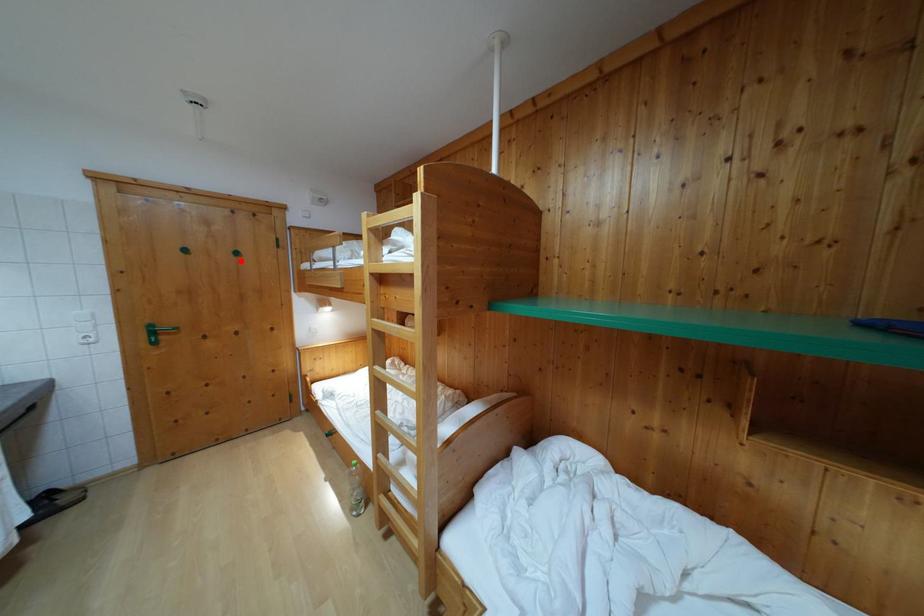
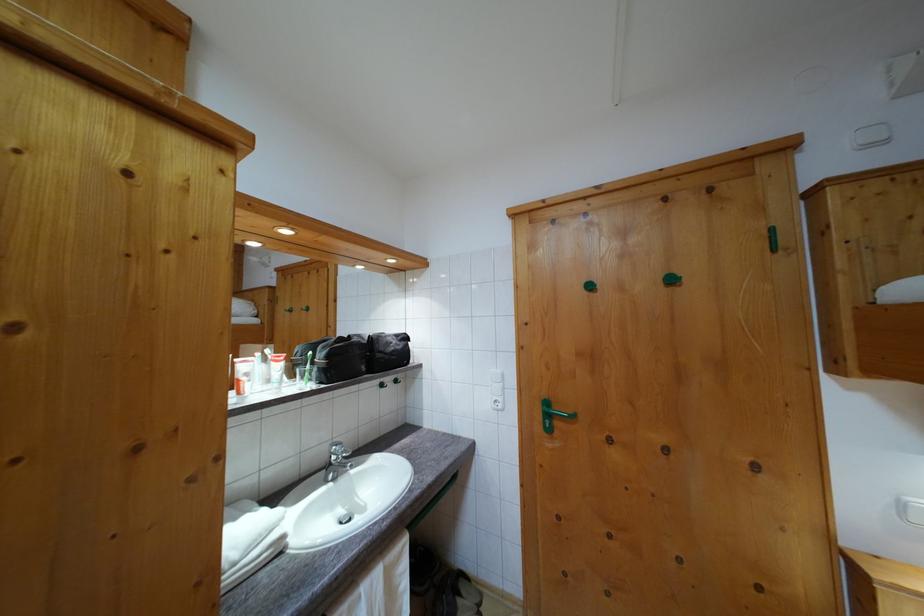
The point at the highlighted location is marked in the first image. Where is the corresponding point in the second image?

(675, 286)